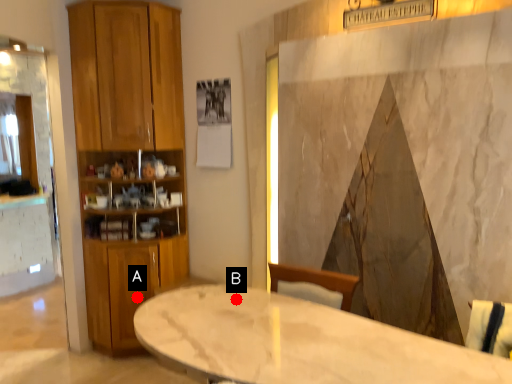
Question: Two points are circled on the image, labeled by A and B beside each circle. Which point is further to the camera?

Choices:
 (A) A is further
 (B) B is further

Answer: (A)